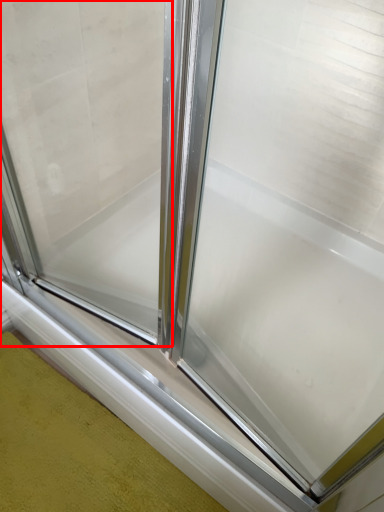
Question: From the image's perspective, where is window screen (annotated by the red box) located in relation to window sill in the image?

Choices:
 (A) above
 (B) below

Answer: (A)